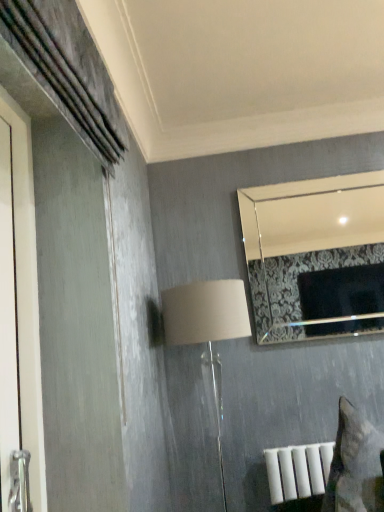
Question: Can you confirm if silver metallic mirror at upper right is bigger than beige fabric lampshade at center?

Choices:
 (A) no
 (B) yes

Answer: (A)

Question: From the image's perspective, is silver metallic mirror at upper right located above beige fabric lampshade at center?

Choices:
 (A) yes
 (B) no

Answer: (A)

Question: Considering the relative sizes of silver metallic mirror at upper right and beige fabric lampshade at center in the image provided, is silver metallic mirror at upper right shorter than beige fabric lampshade at center?

Choices:
 (A) yes
 (B) no

Answer: (A)

Question: Is silver metallic mirror at upper right thinner than beige fabric lampshade at center?

Choices:
 (A) yes
 (B) no

Answer: (A)

Question: Could you tell me if silver metallic mirror at upper right is facing beige fabric lampshade at center?

Choices:
 (A) no
 (B) yes

Answer: (A)

Question: Is silver metallic mirror at upper right next to beige fabric lampshade at center and touching it?

Choices:
 (A) no
 (B) yes

Answer: (A)

Question: Can you confirm if beige fabric lampshade at center is bigger than silver metallic mirror at upper right?

Choices:
 (A) no
 (B) yes

Answer: (B)

Question: Can you confirm if beige fabric lampshade at center is shorter than silver metallic mirror at upper right?

Choices:
 (A) yes
 (B) no

Answer: (B)

Question: Considering the relative positions of beige fabric lampshade at center and silver metallic mirror at upper right in the image provided, is beige fabric lampshade at center behind silver metallic mirror at upper right?

Choices:
 (A) no
 (B) yes

Answer: (A)

Question: From the image's perspective, would you say beige fabric lampshade at center is shown under silver metallic mirror at upper right?

Choices:
 (A) no
 (B) yes

Answer: (B)

Question: Is beige fabric lampshade at center far from silver metallic mirror at upper right?

Choices:
 (A) no
 (B) yes

Answer: (B)

Question: Does beige fabric lampshade at center have a greater height compared to silver metallic mirror at upper right?

Choices:
 (A) yes
 (B) no

Answer: (A)

Question: Looking at the image, does silver metallic mirror at upper right seem bigger or smaller compared to beige fabric lampshade at center?

Choices:
 (A) big
 (B) small

Answer: (B)